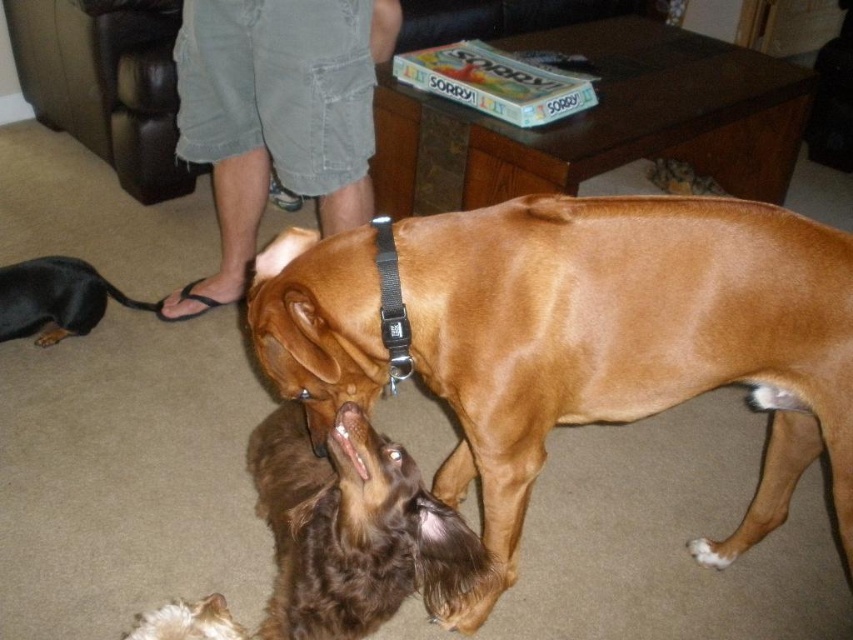
You are a drone operator trying to capture aerial footage of the scene. You need to fly your drone from the point at coordinates point (836,339) to the point at coordinates point (184,93). Considering the spatial relationship between these two points, which direction should you fly the drone to move from the first point to the second?

Since point (836,339) is closer to the viewer than point (184,93), you should fly the drone away from the viewer to reach the second point.

You are a dog owner who wants to place a new dog bed in the living room. The bed is designed to fit objects wider than the gray cotton shorts at lower center. Will the brown shiny dog at center fit on this bed?

The brown shiny dog at center is larger in width than the gray cotton shorts at lower center, so the bed designed for objects wider than the gray cotton shorts at lower center should accommodate the brown shiny dog at center.

You are a dog owner who wants to ensure the brown shiny dog at center is not under the gray cotton shorts at lower center. Based on the scene, is the dog currently in a safe position?

The brown shiny dog at center is positioned under gray cotton shorts at lower center, so it is not in a safe position as it is underneath the shorts.